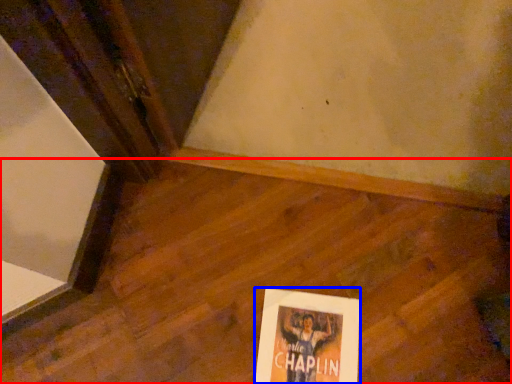
Question: Which of the following is the farthest to the observer, plywood (highlighted by a red box) or poster (highlighted by a blue box)?

Choices:
 (A) plywood
 (B) poster

Answer: (B)